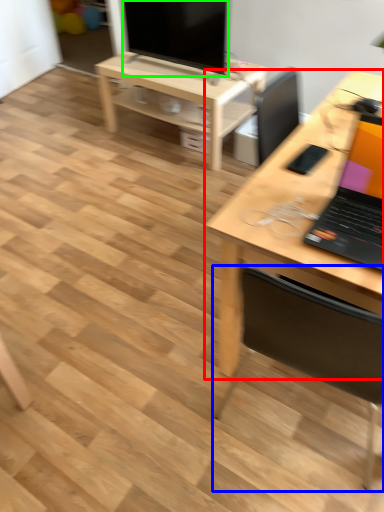
Question: Which object is the farthest from desk (highlighted by a red box)? Choose among these: chair (highlighted by a blue box) or television (highlighted by a green box).

Choices:
 (A) chair
 (B) television

Answer: (B)